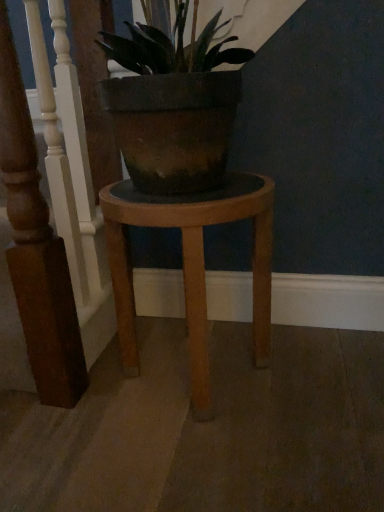
Image resolution: width=384 pixels, height=512 pixels. What do you see at coordinates (191, 263) in the screenshot?
I see `wooden stool at center` at bounding box center [191, 263].

Locate an element on the screen. This screenshot has height=512, width=384. wooden stool at center is located at coordinates (191, 263).

Describe the element at coordinates (72, 202) in the screenshot. The width and height of the screenshot is (384, 512). I see `white painted wood railing at left` at that location.

Where is `white painted wood railing at left`? The height and width of the screenshot is (512, 384). white painted wood railing at left is located at coordinates (72, 202).

This screenshot has height=512, width=384. I want to click on wooden stool at center, so click(x=191, y=263).

Would you say wooden stool at center is to the left or to the right of white painted wood railing at left in the picture?

In the image, wooden stool at center appears on the right side of white painted wood railing at left.

Which object is closer to the camera, wooden stool at center or white painted wood railing at left?

white painted wood railing at left is in front.

Which is nearer, (147,198) or (114,327)?

The point (147,198) is closer to the camera.

From the image's perspective, which is below, wooden stool at center or white painted wood railing at left?

wooden stool at center appears lower in the image.

From a real-world perspective, is wooden stool at center above or below white painted wood railing at left?

From a real-world perspective, wooden stool at center is physically below white painted wood railing at left.

Does wooden stool at center have a greater width compared to white painted wood railing at left?

Yes.

Is wooden stool at center taller than white painted wood railing at left?

No, wooden stool at center is not taller than white painted wood railing at left.

Considering the relative sizes of wooden stool at center and white painted wood railing at left in the image provided, is wooden stool at center smaller than white painted wood railing at left?

No.

Is wooden stool at center not inside white painted wood railing at left?

Yes, wooden stool at center is located beyond the bounds of white painted wood railing at left.

Looking at this image, is there a large distance between wooden stool at center and white painted wood railing at left?

No.

Is wooden stool at center aimed at white painted wood railing at left?

No, wooden stool at center is not facing towards white painted wood railing at left.

How different are the orientations of wooden stool at center and white painted wood railing at left in degrees?

The facing directions of wooden stool at center and white painted wood railing at left are 90.8 degrees apart.

Locate an element on the screen. Image resolution: width=384 pixels, height=512 pixels. rail above the wooden stool at center (from a real-world perspective) is located at coordinates (72, 202).

Does white painted wood railing at left appear on the right side of wooden stool at center?

No.

Which object is further away from the camera taking this photo, white painted wood railing at left or wooden stool at center?

wooden stool at center is behind.

Which is in front, point (87, 263) or point (112, 253)?

The point (112, 253) is closer.

From the image's perspective, is white painted wood railing at left on top of wooden stool at center?

Correct, white painted wood railing at left appears higher than wooden stool at center in the image.

From a real-world perspective, which is physically below, white painted wood railing at left or wooden stool at center?

wooden stool at center.

Is white painted wood railing at left wider or thinner than wooden stool at center?

In the image, white painted wood railing at left appears to be more narrow than wooden stool at center.

Is white painted wood railing at left shorter than wooden stool at center?

Incorrect, the height of white painted wood railing at left does not fall short of that of wooden stool at center.

Considering the sizes of white painted wood railing at left and wooden stool at center in the image, is white painted wood railing at left bigger or smaller than wooden stool at center?

In the image, white painted wood railing at left appears to be smaller than wooden stool at center.

Is white painted wood railing at left situated inside wooden stool at center or outside?

white painted wood railing at left is not enclosed by wooden stool at center.

Are white painted wood railing at left and wooden stool at center making contact?

white painted wood railing at left and wooden stool at center are clearly separated.

Is white painted wood railing at left oriented towards wooden stool at center?

Yes, white painted wood railing at left faces towards wooden stool at center.

Can you tell me how much white painted wood railing at left and wooden stool at center differ in facing direction?

The facing directions of white painted wood railing at left and wooden stool at center are 90.8 degrees apart.

How far apart are white painted wood railing at left and wooden stool at center?

white painted wood railing at left is 10.05 inches away from wooden stool at center.

The width and height of the screenshot is (384, 512). I want to click on rail located above the wooden stool at center (from a real-world perspective), so click(72, 202).

Where is `rail that is above the wooden stool at center (from the image's perspective)`? The height and width of the screenshot is (512, 384). rail that is above the wooden stool at center (from the image's perspective) is located at coordinates (72, 202).

I want to click on stool below the white painted wood railing at left (from the image's perspective), so click(x=191, y=263).